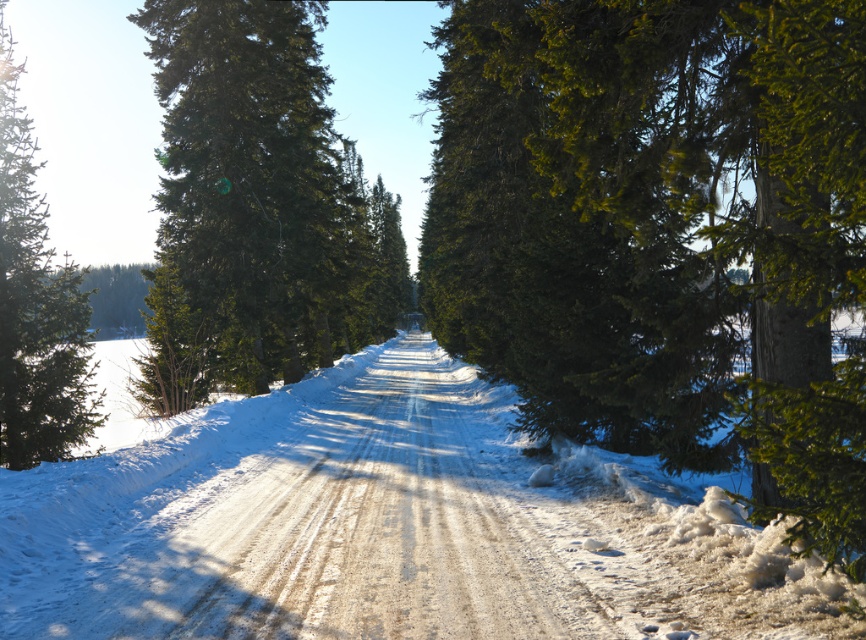
You are a hiker planning to walk along the white sandy dirt track at center and pass by the green matte evergreen tree at left. Since the track is narrow, will you have enough space to walk comfortably without stepping onto the snow on either side?

The white sandy dirt track at center is thinner than the green matte evergreen tree at left. Since the track is narrower, you may not have enough space to walk comfortably without stepping onto the snow on either side.

You are a hiker trying to follow the path in this winter scene. You see the white sandy dirt track at center and the green matte evergreen tree at left. Which direction should you head relative to the tree to stay on the path?

To stay on the path, you should head to the right of the green matte evergreen tree at left because the white sandy dirt track at center is located to the right of the tree.

You are a hiker trying to determine which tree is shorter between the green textured pine tree at center and the green matte tree at center. Based on the scene, which one should you identify as the shorter tree?

The green textured pine tree at center is shorter than the green matte tree at center.